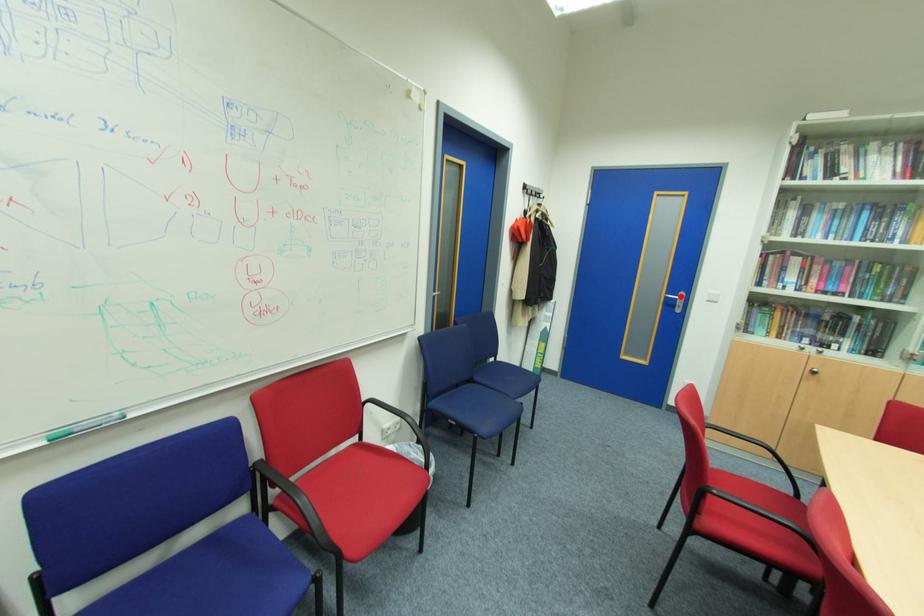
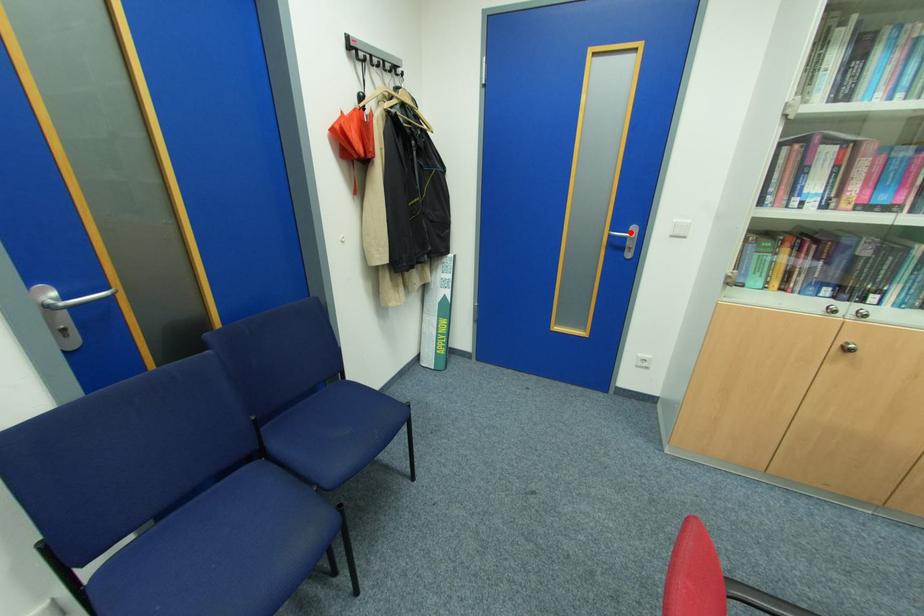
I am providing you with two images of the same scene from different viewpoints. A red point is marked on the first image and another point is marked on the second image. Is the red point in image1 aligned with the point shown in image2?

Yes